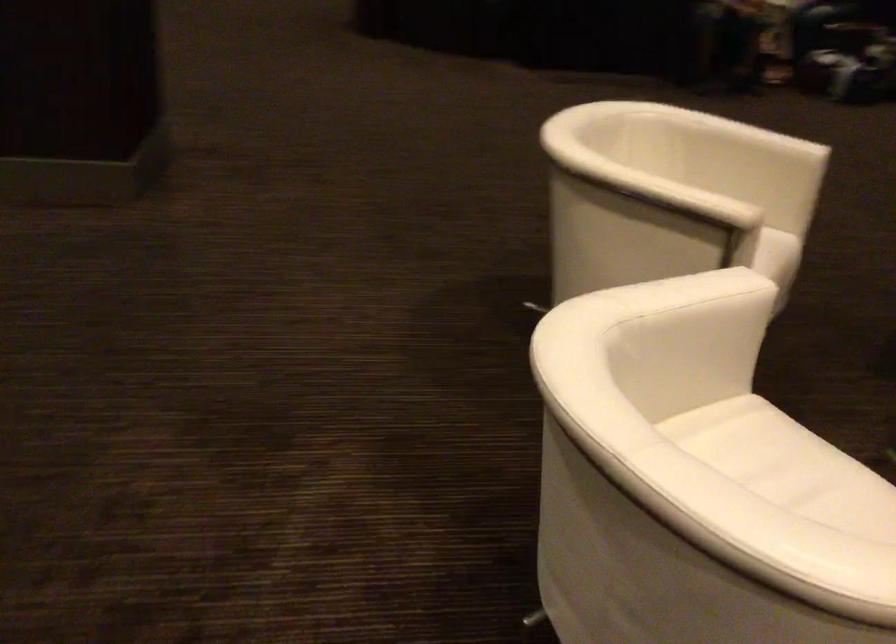
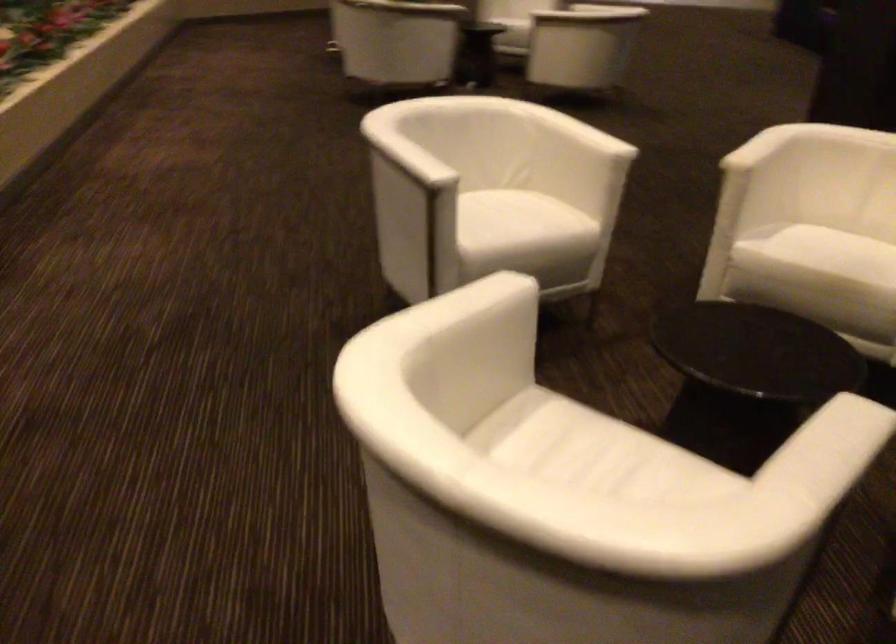
Locate, in the second image, the point that corresponds to (800,498) in the first image.

(502, 214)